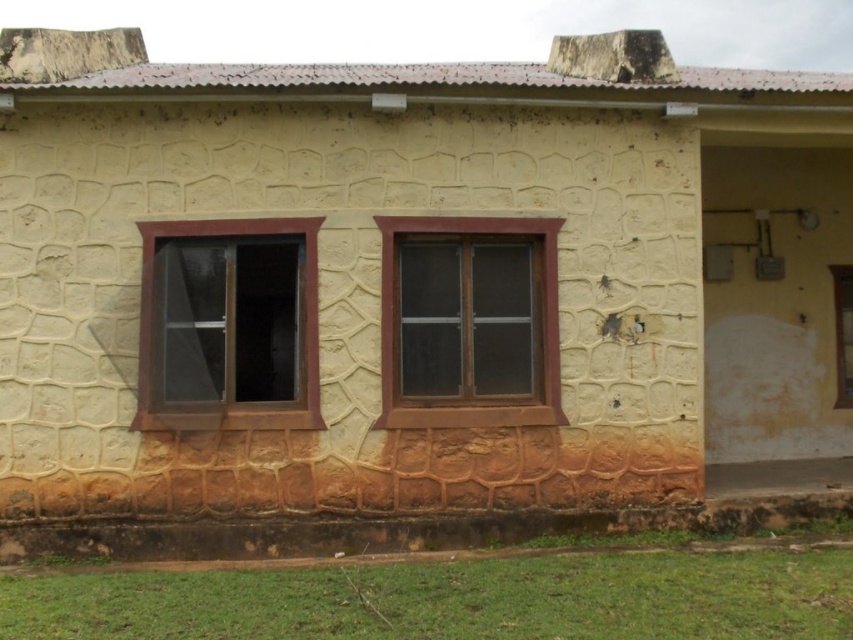
Question: Is brown wooden window at left above clear glass window at center right?

Choices:
 (A) no
 (B) yes

Answer: (B)

Question: Is brown wooden window at left positioned at the back of clear glass window at center right?

Choices:
 (A) yes
 (B) no

Answer: (B)

Question: Can you confirm if brown wooden window at left is smaller than clear glass window at center right?

Choices:
 (A) no
 (B) yes

Answer: (A)

Question: Based on their relative distances, which object is nearer to the brown wooden window at center?

Choices:
 (A) clear glass window at center right
 (B) brown wooden window at left

Answer: (B)

Question: Which point is closer to the camera?

Choices:
 (A) brown wooden window at left
 (B) clear glass window at center right
 (C) brown wooden window at center

Answer: (A)

Question: Which point is farther to the camera?

Choices:
 (A) coord(161,348)
 (B) coord(393,332)
 (C) coord(839,369)

Answer: (C)